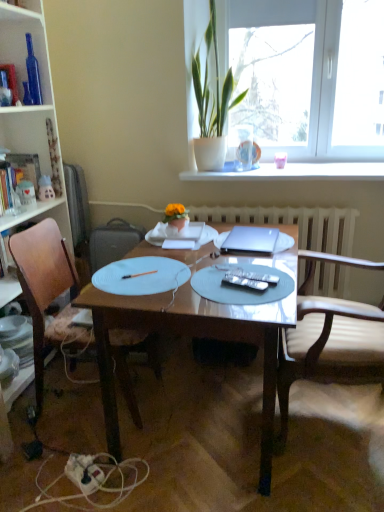
What are the coordinates of `vacant region in front of brown wood chair at left, which is the 1th chair in left-to-right order` in the screenshot? It's located at [x=71, y=467].